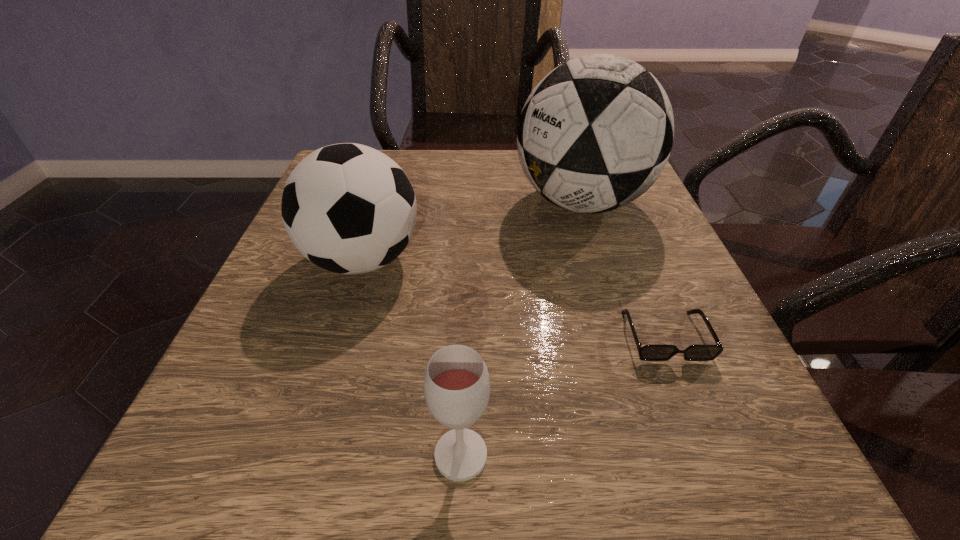
The image size is (960, 540). I want to click on the taller soccer ball, so [x=595, y=133].

Identify the location of the tallest object. (595, 133).

The height and width of the screenshot is (540, 960). What are the coordinates of `the second tallest object` in the screenshot? It's located at (348, 208).

Identify the location of the shorter soccer ball. The height and width of the screenshot is (540, 960). (348, 208).

Image resolution: width=960 pixels, height=540 pixels. Find the location of `the nearest object`. the nearest object is located at coordinates [456, 384].

This screenshot has width=960, height=540. What are the coordinates of `the second object from left to right` in the screenshot? It's located at (x=456, y=384).

This screenshot has width=960, height=540. Identify the location of the shortest object. (655, 352).

Locate an element on the screen. The image size is (960, 540). sunglasses is located at coordinates (655, 352).

Identify the location of vacant space positioned 0.260m on the surface of the taller soccer ball where the brand logo is visible. The width and height of the screenshot is (960, 540). (388, 202).

Where is `vacant region located 0.220m on the surface of the taller soccer ball where the brand logo is visible`? vacant region located 0.220m on the surface of the taller soccer ball where the brand logo is visible is located at coordinates (407, 202).